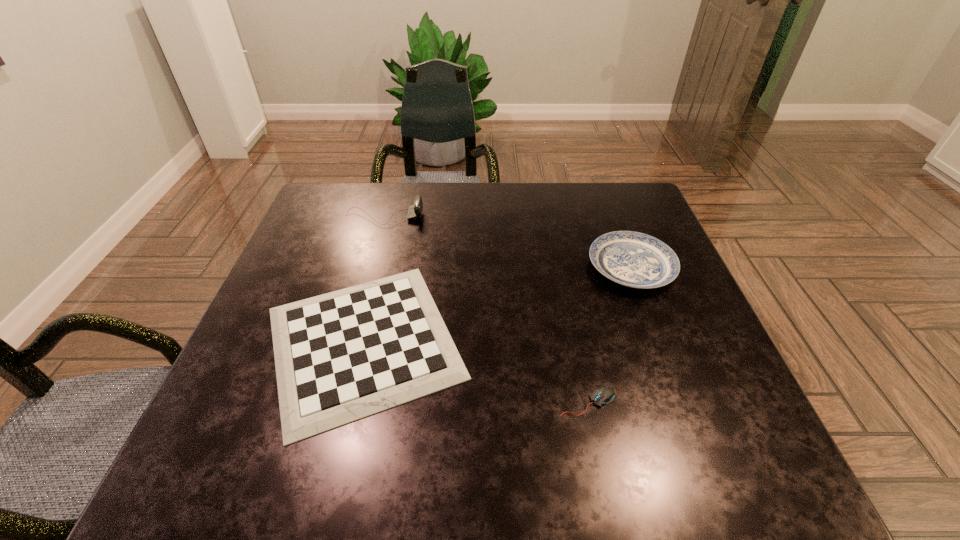
At what (x,y) coordinates should I click in order to perform the action: click on the farthest object. Please return your answer as a coordinate pair (x, y). Image resolution: width=960 pixels, height=540 pixels. Looking at the image, I should click on (415, 210).

This screenshot has height=540, width=960. What are the coordinates of `the tallest object` in the screenshot? It's located at (415, 210).

Locate an element on the screen. the second tallest object is located at coordinates (633, 259).

Locate an element on the screen. Image resolution: width=960 pixels, height=540 pixels. plate is located at coordinates (633, 259).

Find the location of a particular element. This screenshot has height=540, width=960. chessboard is located at coordinates (342, 356).

This screenshot has height=540, width=960. In order to click on the third object from left to right in this screenshot , I will do `click(604, 395)`.

Locate an element on the screen. free region located on the front-facing side of the farthest object is located at coordinates (473, 217).

Locate an element on the screen. The width and height of the screenshot is (960, 540). free region located on the left of the plate is located at coordinates (531, 267).

Where is `vacant space located 0.100m on the right of the chessboard`? vacant space located 0.100m on the right of the chessboard is located at coordinates (520, 342).

This screenshot has height=540, width=960. Find the location of `free space located on the left of the second object from right to left`. free space located on the left of the second object from right to left is located at coordinates (421, 402).